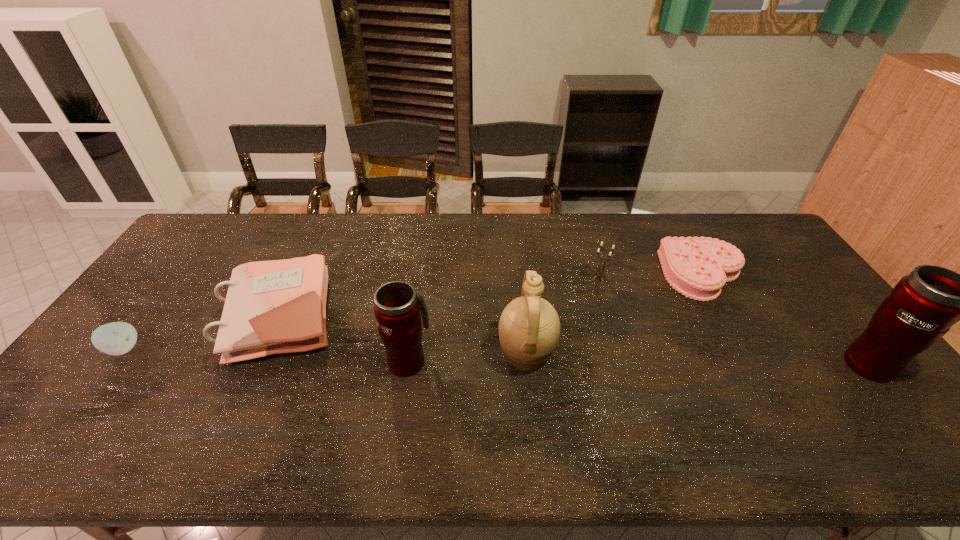
Where is `free space in the image that satisfies the following two spatial constraints: 1. on the side with the handle of the shorter thermos bottle; 2. on the right side of the shortest object`? free space in the image that satisfies the following two spatial constraints: 1. on the side with the handle of the shorter thermos bottle; 2. on the right side of the shortest object is located at coordinates (421, 275).

Identify the location of vacant area in the image that satisfies the following two spatial constraints: 1. on the back side of the fourth object from left to right; 2. on the left side of the shortest object. (518, 275).

You are a GUI agent. You are given a task and a screenshot of the screen. Output one action in this format:
    pyautogui.click(x=<x>, y=<y>)
    Task: Click on the blank area in the image that satisfies the following two spatial constraints: 1. on the side with the handle of the pitcher; 2. on the left side of the fifth object from right to left
    
    Given the screenshot: What is the action you would take?
    pyautogui.click(x=410, y=353)